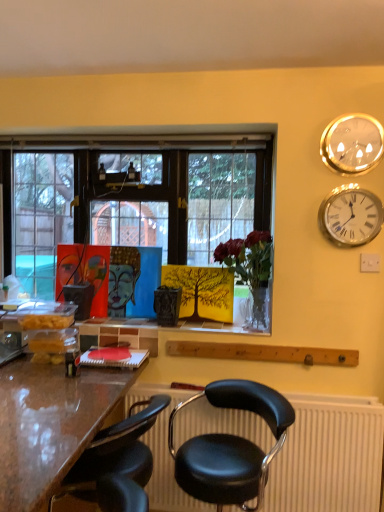
Question: Could you tell me if silver metallic clock at upper right, acting as the second wall clock starting from the top, is facing translucent glass vase at center?

Choices:
 (A) no
 (B) yes

Answer: (A)

Question: Is silver metallic clock at upper right, which is the 1th wall clock from bottom to top, bigger than translucent glass vase at center?

Choices:
 (A) no
 (B) yes

Answer: (A)

Question: Is silver metallic clock at upper right, which is the 1th wall clock from bottom to top, smaller than translucent glass vase at center?

Choices:
 (A) no
 (B) yes

Answer: (B)

Question: Is silver metallic clock at upper right, which is the 1th wall clock from bottom to top, far from translucent glass vase at center?

Choices:
 (A) yes
 (B) no

Answer: (B)

Question: Is silver metallic clock at upper right, which is the 1th wall clock from bottom to top, facing away from translucent glass vase at center?

Choices:
 (A) no
 (B) yes

Answer: (A)

Question: Considering the positions of black leather chair at center, the first chair when ordered from right to left, and silver metallic clock at upper right, acting as the second wall clock starting from the top, in the image, is black leather chair at center, the first chair when ordered from right to left, bigger or smaller than silver metallic clock at upper right, acting as the second wall clock starting from the top,?

Choices:
 (A) big
 (B) small

Answer: (A)

Question: In terms of height, does black leather chair at center, the first chair when ordered from right to left, look taller or shorter compared to silver metallic clock at upper right, acting as the second wall clock starting from the top?

Choices:
 (A) tall
 (B) short

Answer: (A)

Question: In the image, is black leather chair at center, marked as the second chair in a left-to-right arrangement, positioned in front of or behind silver metallic clock at upper right, acting as the second wall clock starting from the top?

Choices:
 (A) front
 (B) behind

Answer: (A)

Question: Considering the positions of black leather chair at center, marked as the second chair in a left-to-right arrangement, and silver metallic clock at upper right, which is the 1th wall clock from bottom to top, in the image, is black leather chair at center, marked as the second chair in a left-to-right arrangement, wider or thinner than silver metallic clock at upper right, which is the 1th wall clock from bottom to top,?

Choices:
 (A) wide
 (B) thin

Answer: (A)

Question: Is point (69, 391) positioned closer to the camera than point (327, 426)?

Choices:
 (A) farther
 (B) closer

Answer: (B)

Question: Which is correct: shiny brown desk at lower left is inside black plastic radiator at lower center, or outside of it?

Choices:
 (A) outside
 (B) inside

Answer: (A)

Question: Looking at their shapes, would you say shiny brown desk at lower left is wider or thinner than black plastic radiator at lower center?

Choices:
 (A) thin
 (B) wide

Answer: (B)

Question: Considering the positions of shiny brown desk at lower left and black plastic radiator at lower center in the image, is shiny brown desk at lower left bigger or smaller than black plastic radiator at lower center?

Choices:
 (A) small
 (B) big

Answer: (B)

Question: From a real-world perspective, is silver metallic clock at upper right, acting as the second wall clock starting from the top, above or below translucent glass vase at center?

Choices:
 (A) below
 (B) above

Answer: (B)

Question: From the image's perspective, is silver metallic clock at upper right, acting as the second wall clock starting from the top, above or below translucent glass vase at center?

Choices:
 (A) above
 (B) below

Answer: (A)